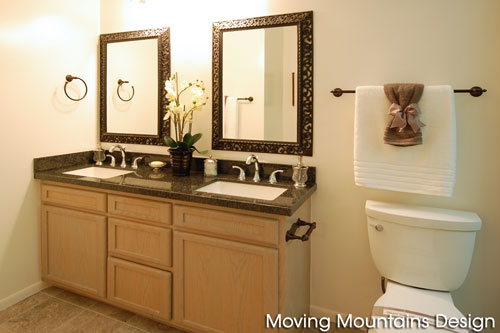
You are a GUI agent. You are given a task and a screenshot of the screen. Output one action in this format:
    pyautogui.click(x=<x>, y=<y>)
    Task: Click on the cabinet
    
    Given the screenshot: What is the action you would take?
    pyautogui.click(x=202, y=281), pyautogui.click(x=78, y=251)